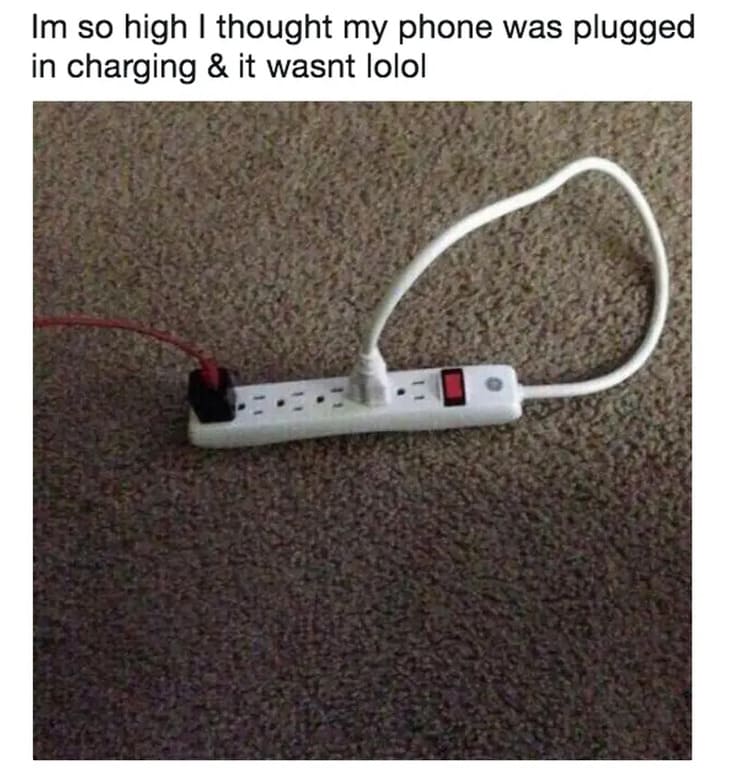
Image resolution: width=732 pixels, height=772 pixels. I want to click on charger, so click(x=206, y=371).